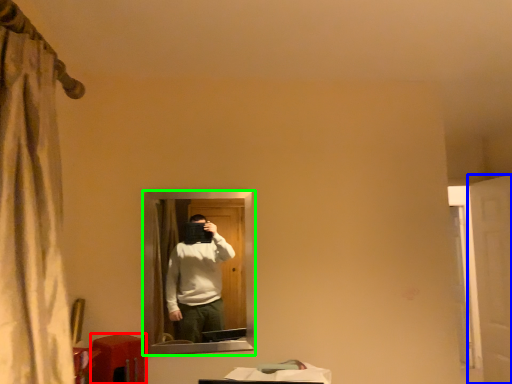
Question: Based on their relative distances, which object is farther from table (highlighted by a red box)? Choose from screen door (highlighted by a blue box) and mirror (highlighted by a green box).

Choices:
 (A) screen door
 (B) mirror

Answer: (A)